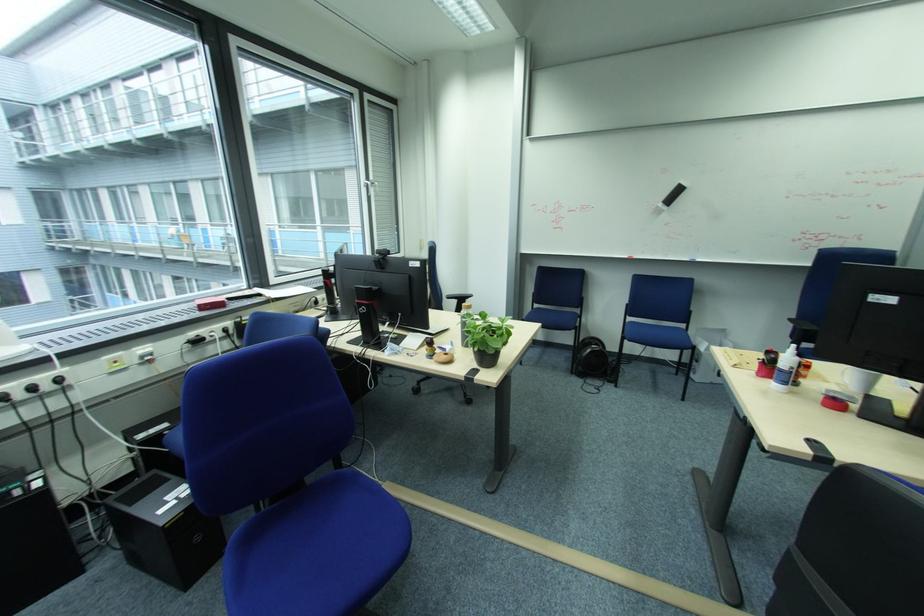
Find the location of a particular element. The height and width of the screenshot is (616, 924). potted green plant is located at coordinates (485, 337).